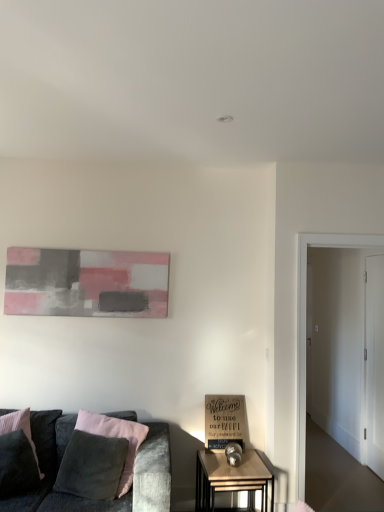
Find the location of a particular element. Image resolution: width=384 pixels, height=512 pixels. free point above abstract painting at upper left (from a real-world perspective) is located at coordinates (68, 246).